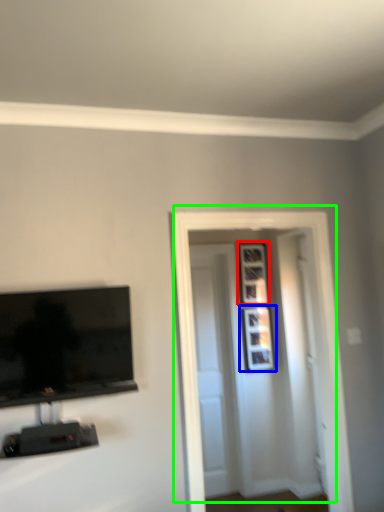
Question: Considering the real-world distances, which object is closest to picture frame (highlighted by a red box)? picture frame (highlighted by a blue box) or door (highlighted by a green box).

Choices:
 (A) picture frame
 (B) door

Answer: (A)